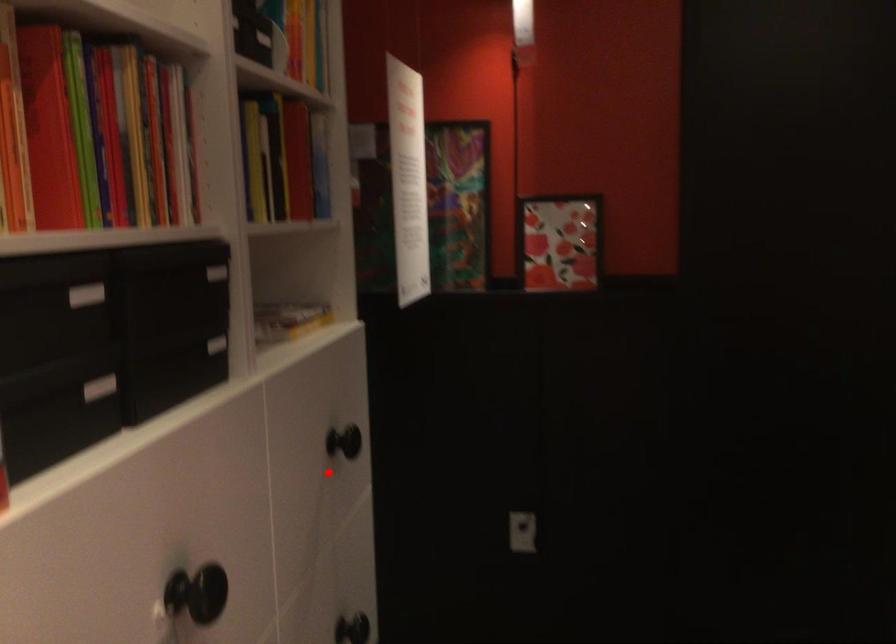
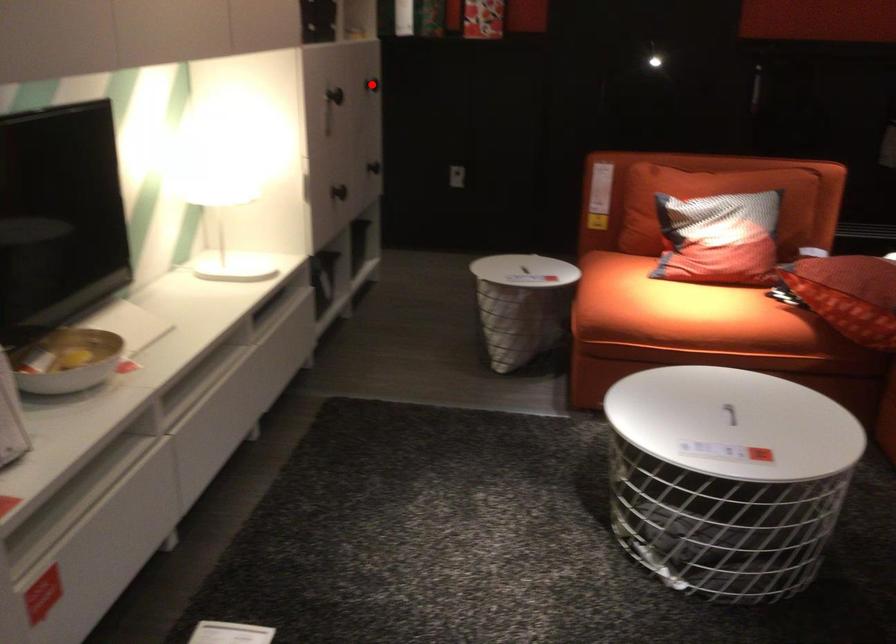
I am providing you with two images of the same scene from different viewpoints. A red point is marked on the first image and another point is marked on the second image. Does the point marked in image1 correspond to the same location as the one in image2?

Yes